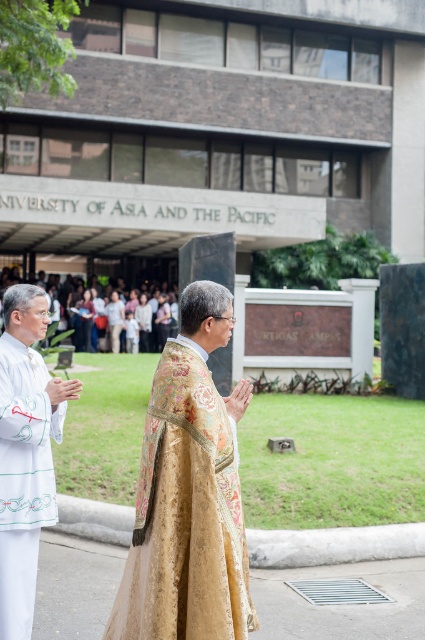
Question: Which point is farther to the camera?

Choices:
 (A) gold brocade robe at center
 (B) white silk robe at left

Answer: (B)

Question: Does gold brocade robe at center lie in front of white silk robe at left?

Choices:
 (A) no
 (B) yes

Answer: (B)

Question: Does gold brocade robe at center appear over white silk robe at left?

Choices:
 (A) no
 (B) yes

Answer: (B)

Question: Among these points, which one is nearest to the camera?

Choices:
 (A) (8, 378)
 (B) (181, 609)

Answer: (B)

Question: Can you confirm if gold brocade robe at center is smaller than white silk robe at left?

Choices:
 (A) yes
 (B) no

Answer: (B)